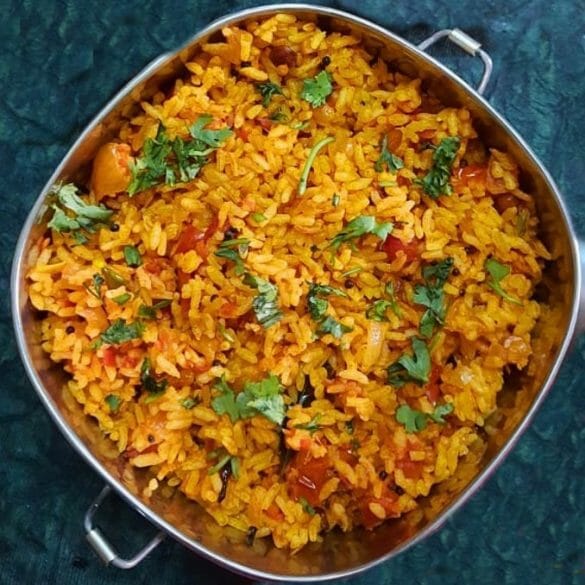
Locate an element on the screen. The height and width of the screenshot is (585, 585). 1 metal bowl is located at coordinates point(185,533).